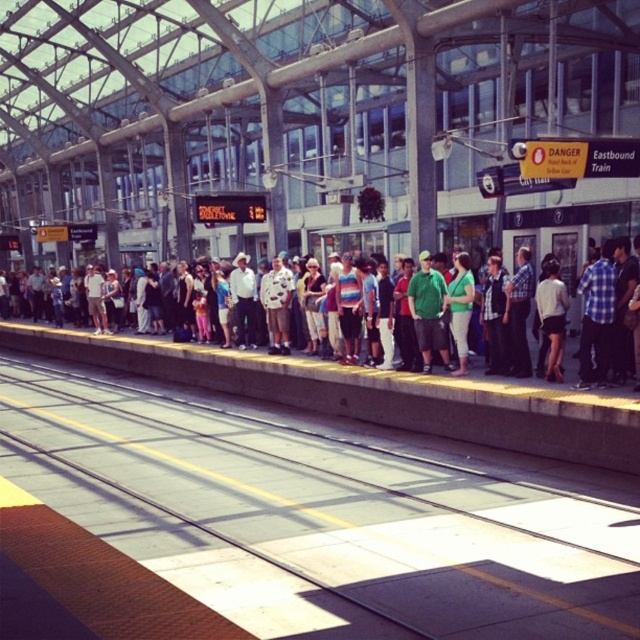
Question: Which object is farther from the camera taking this photo?

Choices:
 (A) multicolored casual clothing at center
 (B) smooth concrete train track at center

Answer: (A)

Question: Does smooth concrete train track at center have a greater width compared to multicolored casual clothing at center?

Choices:
 (A) no
 (B) yes

Answer: (A)

Question: Observing the image, what is the correct spatial positioning of smooth concrete train track at center in reference to multicolored casual clothing at center?

Choices:
 (A) left
 (B) right

Answer: (A)

Question: Which object appears closest to the camera in this image?

Choices:
 (A) smooth concrete train track at center
 (B) multicolored casual clothing at center

Answer: (A)

Question: Observing the image, what is the correct spatial positioning of smooth concrete train track at center in reference to multicolored casual clothing at center?

Choices:
 (A) above
 (B) below

Answer: (B)

Question: Among these objects, which one is farthest from the camera?

Choices:
 (A) multicolored casual clothing at center
 (B) smooth concrete train track at center

Answer: (A)